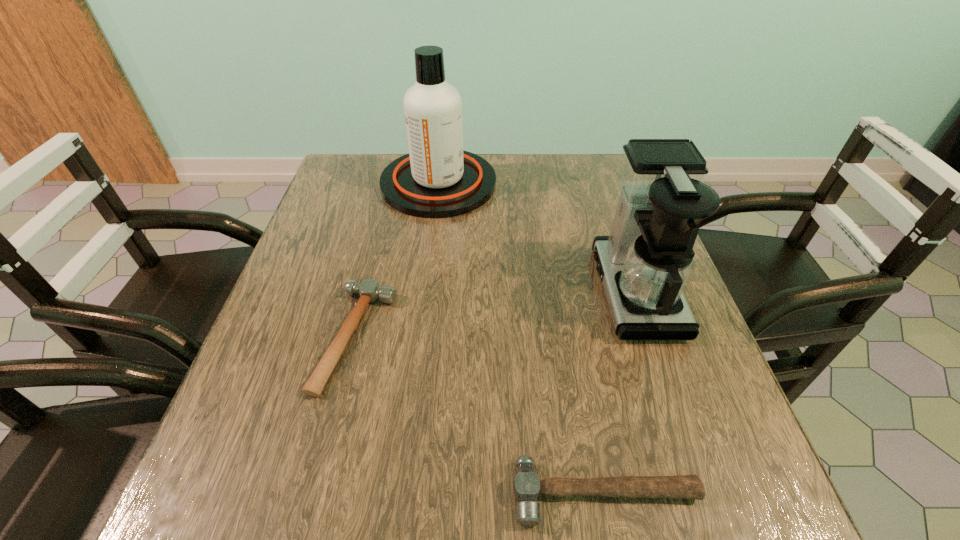
Find the location of a particular element. This screenshot has width=960, height=540. vacant point located between the cleansing agent and the left hammer is located at coordinates (397, 260).

I want to click on empty space between the right hammer and the farther hammer, so click(481, 415).

I want to click on free space that is in between the nearer hammer and the second tallest object, so click(620, 392).

This screenshot has height=540, width=960. I want to click on empty space between the cleansing agent and the left hammer, so click(397, 260).

You are a GUI agent. You are given a task and a screenshot of the screen. Output one action in this format:
    pyautogui.click(x=<x>, y=<y>)
    Task: Click on the free space that is in between the coffee maker and the left hammer
    The image size is (960, 540).
    Given the screenshot: What is the action you would take?
    pyautogui.click(x=496, y=315)

Locate an element on the screen. vacant area that lies between the nearest object and the second tallest object is located at coordinates (620, 392).

Locate an element on the screen. This screenshot has width=960, height=540. object that can be found as the third closest to the right hammer is located at coordinates (437, 179).

You are a GUI agent. You are given a task and a screenshot of the screen. Output one action in this format:
    pyautogui.click(x=<x>, y=<y>)
    Task: Click on the third closest object to the tallest object
    The image size is (960, 540).
    Given the screenshot: What is the action you would take?
    pyautogui.click(x=526, y=486)

The image size is (960, 540). I want to click on free location that satisfies the following two spatial constraints: 1. at the front of the second tallest object where the controls are located; 2. on the striking face of the right hammer, so click(x=704, y=493).

This screenshot has width=960, height=540. I want to click on vacant space that satisfies the following two spatial constraints: 1. at the front of the coffee maker where the controls are located; 2. on the striking face of the right hammer, so click(704, 493).